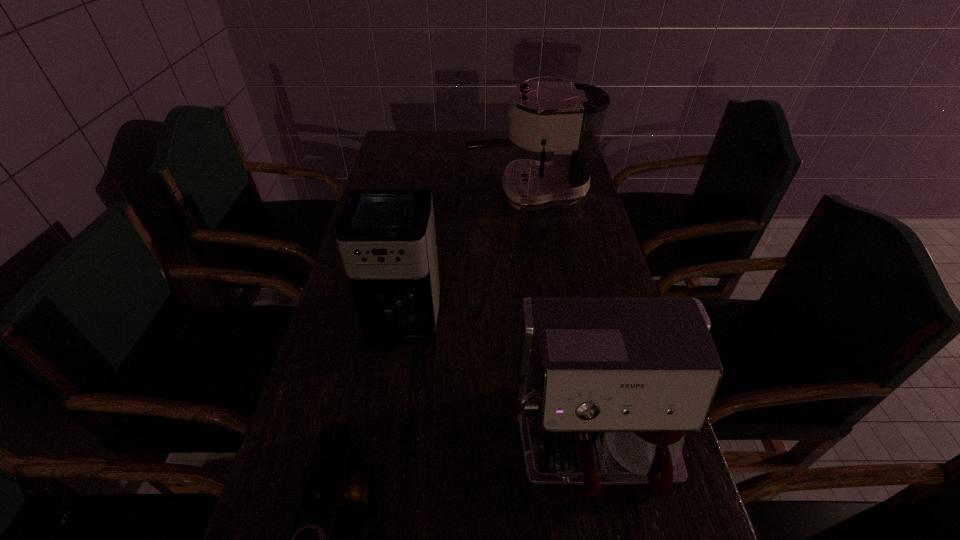
This screenshot has width=960, height=540. Identify the location of coffee maker that is the second nearest to the farthest object. (605, 387).

Find the location of a particular element. Image resolution: width=960 pixels, height=540 pixels. free point that satisfies the following two spatial constraints: 1. on the front-facing side of the farthest object; 2. on the front panel of the leftmost coffee maker is located at coordinates (547, 322).

Where is `free space that satisfies the following two spatial constraints: 1. on the front-facing side of the farthest coffee maker; 2. on the front panel of the leftmost coffee maker`? The height and width of the screenshot is (540, 960). free space that satisfies the following two spatial constraints: 1. on the front-facing side of the farthest coffee maker; 2. on the front panel of the leftmost coffee maker is located at coordinates (547, 322).

The width and height of the screenshot is (960, 540). Identify the location of vacant space that satisfies the following two spatial constraints: 1. on the front-facing side of the farthest object; 2. on the front panel of the second farthest object. (547, 322).

Where is `vacant space that satisfies the following two spatial constraints: 1. on the front-facing side of the farthest object; 2. on the front panel of the leftmost coffee maker`? Image resolution: width=960 pixels, height=540 pixels. vacant space that satisfies the following two spatial constraints: 1. on the front-facing side of the farthest object; 2. on the front panel of the leftmost coffee maker is located at coordinates (547, 322).

The height and width of the screenshot is (540, 960). Find the location of `free location that satisfies the following two spatial constraints: 1. on the front-facing side of the farthest object; 2. on the front panel of the third nearest object`. free location that satisfies the following two spatial constraints: 1. on the front-facing side of the farthest object; 2. on the front panel of the third nearest object is located at coordinates (547, 322).